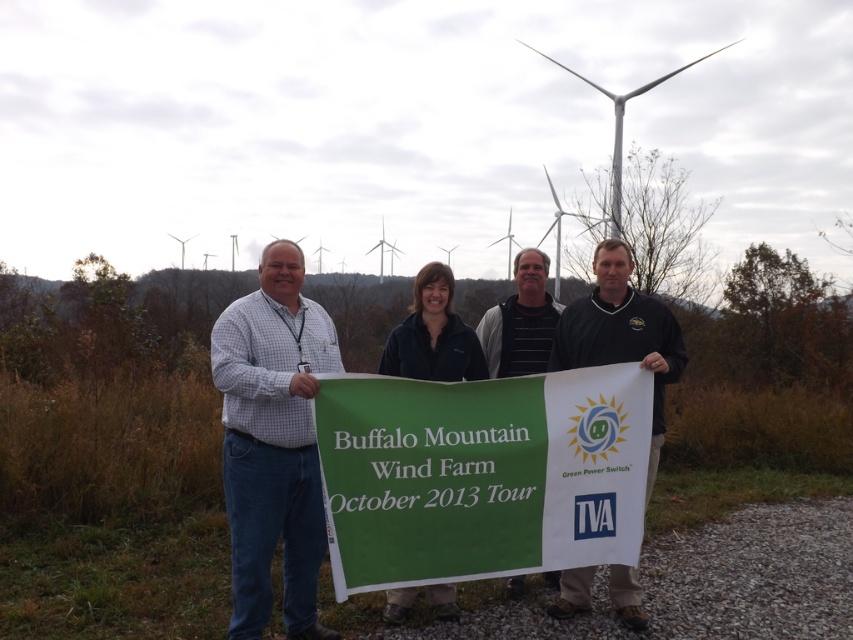
Looking at this image, can you confirm if black fabric at center is positioned to the left of striped sweater at center?

No, black fabric at center is not to the left of striped sweater at center.

Does black fabric at center have a greater height compared to striped sweater at center?

Yes.

Measure the distance between black fabric at center and camera.

The distance of black fabric at center from camera is 4.01 meters.

Identify the location of black fabric at center. (621, 333).

Image resolution: width=853 pixels, height=640 pixels. Identify the location of checkered shirt at left. (273, 442).

Is point (248, 618) farther from viewer compared to point (521, 349)?

No, it is in front of (521, 349).

Is point (291, 490) in front of point (489, 317)?

That is True.

Image resolution: width=853 pixels, height=640 pixels. What are the coordinates of `checkered shirt at left` in the screenshot? It's located at (273, 442).

Can you confirm if green paper banner at center is smaller than checkered shirt at left?

Correct, green paper banner at center occupies less space than checkered shirt at left.

Does green paper banner at center appear under checkered shirt at left?

Correct, green paper banner at center is located below checkered shirt at left.

Between point (524, 545) and point (253, 522), which one is positioned behind?

The point (253, 522) is behind.

Locate an element on the screen. Image resolution: width=853 pixels, height=640 pixels. green paper banner at center is located at coordinates coord(480,474).